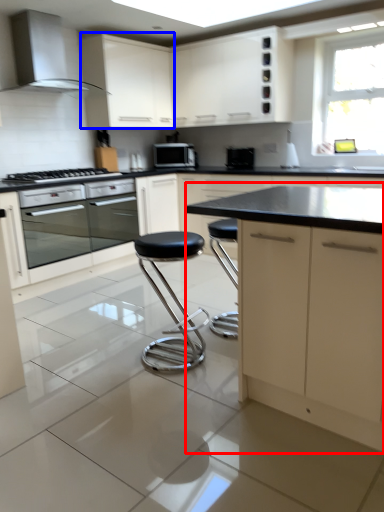
Question: Which object is further to the camera taking this photo, cabinetry (highlighted by a red box) or cabinetry (highlighted by a blue box)?

Choices:
 (A) cabinetry
 (B) cabinetry

Answer: (B)